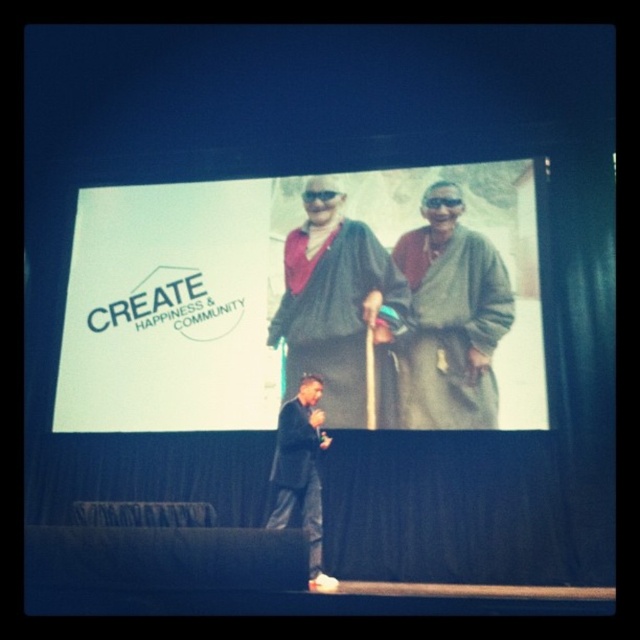
Question: Estimate the real-world distances between objects in this image. Which object is farther from the white paper at upper center?

Choices:
 (A) dark green textured robe at center
 (B) green woolen robe at center

Answer: (B)

Question: Which is farther from the green woolen robe at center?

Choices:
 (A) dark green textured robe at center
 (B) white paper at upper center
 (C) dark gray woolen robe at center

Answer: (C)

Question: Considering the real-world distances, which object is farthest from the dark green textured robe at center?

Choices:
 (A) dark gray woolen robe at center
 (B) white paper at upper center

Answer: (A)

Question: Can you confirm if dark green textured robe at center is smaller than dark gray woolen robe at center?

Choices:
 (A) no
 (B) yes

Answer: (A)

Question: Does white paper at upper center appear under green woolen robe at center?

Choices:
 (A) no
 (B) yes

Answer: (A)

Question: Is dark green textured robe at center positioned in front of dark gray woolen robe at center?

Choices:
 (A) no
 (B) yes

Answer: (A)